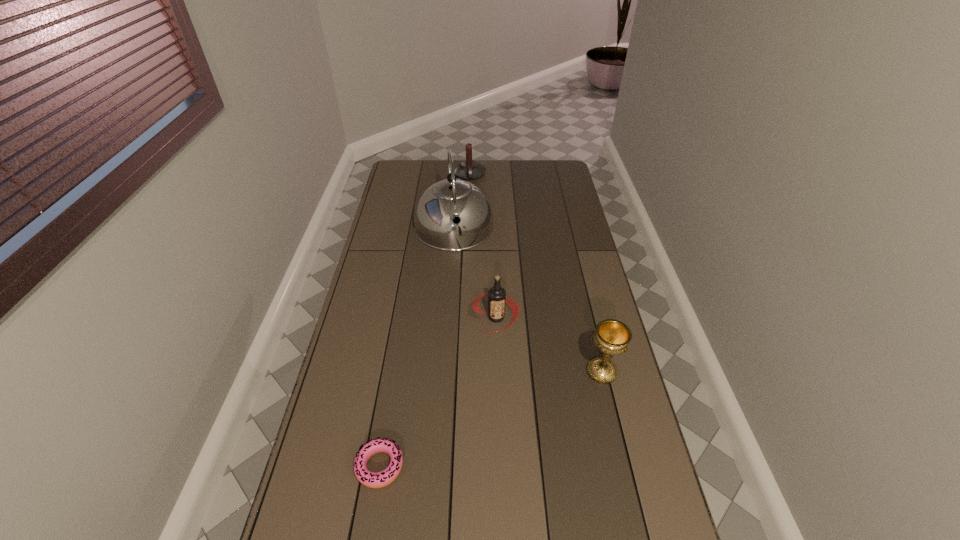
Where is `doughnut`? This screenshot has width=960, height=540. doughnut is located at coordinates (383, 478).

You are a GUI agent. You are given a task and a screenshot of the screen. Output one action in this format:
    pyautogui.click(x=<x>, y=<y>)
    Task: Click on the shortest object
    The image size is (960, 540).
    Given the screenshot: What is the action you would take?
    pyautogui.click(x=383, y=478)

Where is `chalice`? chalice is located at coordinates (612, 337).

This screenshot has height=540, width=960. I want to click on the second nearest object, so click(x=612, y=337).

You are a GUI agent. You are given a task and a screenshot of the screen. Output one action in this format:
    pyautogui.click(x=<x>, y=<y>)
    Task: Click on the farthest object
    
    Given the screenshot: What is the action you would take?
    pyautogui.click(x=468, y=169)

Locate an element on the screen. the third nearest object is located at coordinates (497, 297).

Where is `kettle`? kettle is located at coordinates (434, 225).

Where is `the second farthest object`? the second farthest object is located at coordinates tap(434, 225).

Where is `vacant space situated 0.250m on the back of the doughnut`? This screenshot has width=960, height=540. vacant space situated 0.250m on the back of the doughnut is located at coordinates (396, 368).

The image size is (960, 540). What are the coordinates of `vacant area situated 0.130m on the back of the chalice` in the screenshot? It's located at (591, 327).